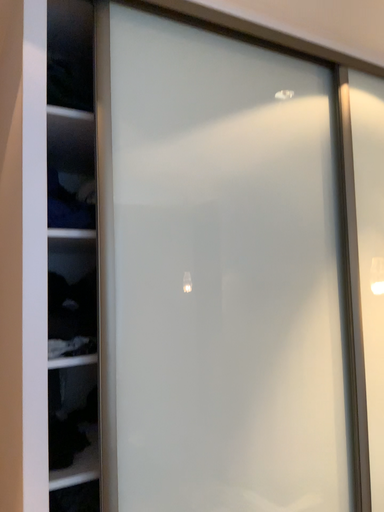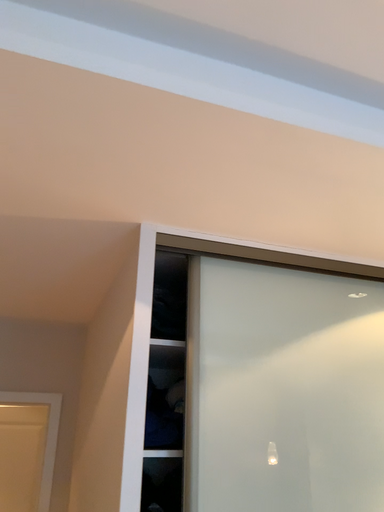
Question: Which way did the camera rotate in the video?

Choices:
 (A) rotated right
 (B) rotated left

Answer: (B)